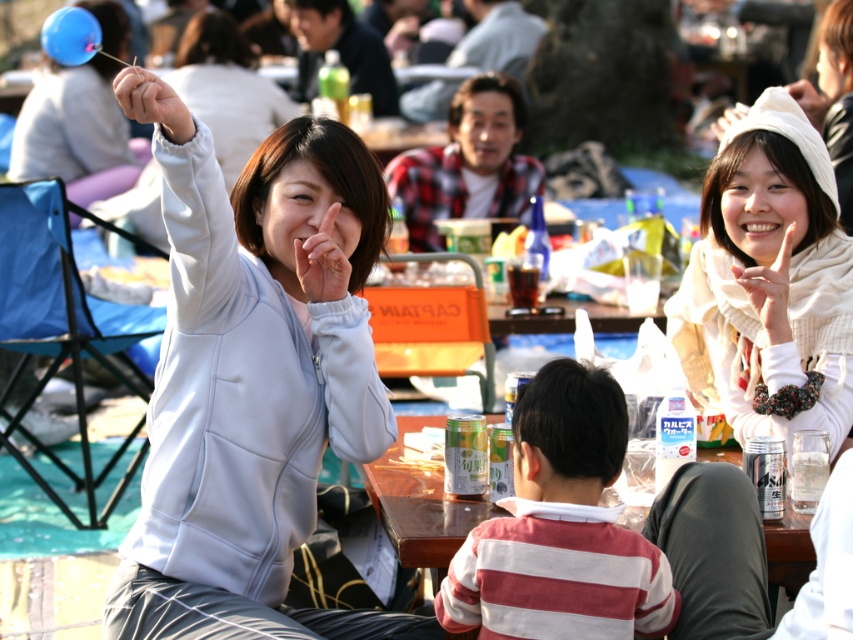
Question: Observing the image, what is the correct spatial positioning of light blue fabric jacket at center in reference to striped cotton shirt at center?

Choices:
 (A) above
 (B) below

Answer: (A)

Question: Which point is closer to the camera?

Choices:
 (A) (415, 620)
 (B) (554, 557)
 (C) (828, 401)
 (D) (778, 561)

Answer: (B)

Question: Which object is farther from the camera taking this photo?

Choices:
 (A) striped cotton shirt at center
 (B) wooden table at center

Answer: (B)

Question: Which object is closer to the camera taking this photo?

Choices:
 (A) striped cotton shirt at center
 (B) light blue fabric jacket at center
 (C) white knitted hat at upper right
 (D) wooden table at center

Answer: (A)

Question: Can you confirm if white knitted hat at upper right is wider than wooden table at center?

Choices:
 (A) no
 (B) yes

Answer: (B)

Question: Can you confirm if light blue fabric jacket at center is positioned below white knitted hat at upper right?

Choices:
 (A) yes
 (B) no

Answer: (A)